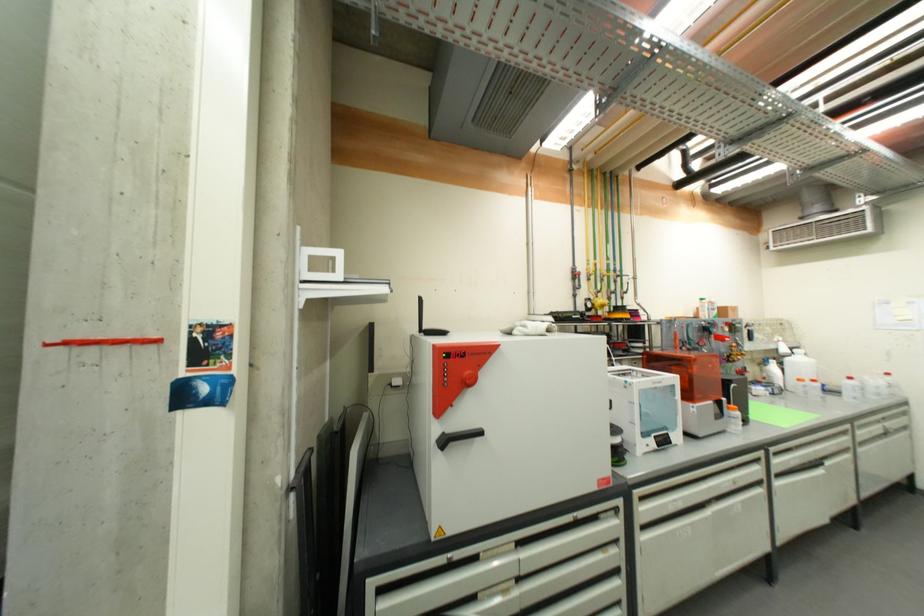
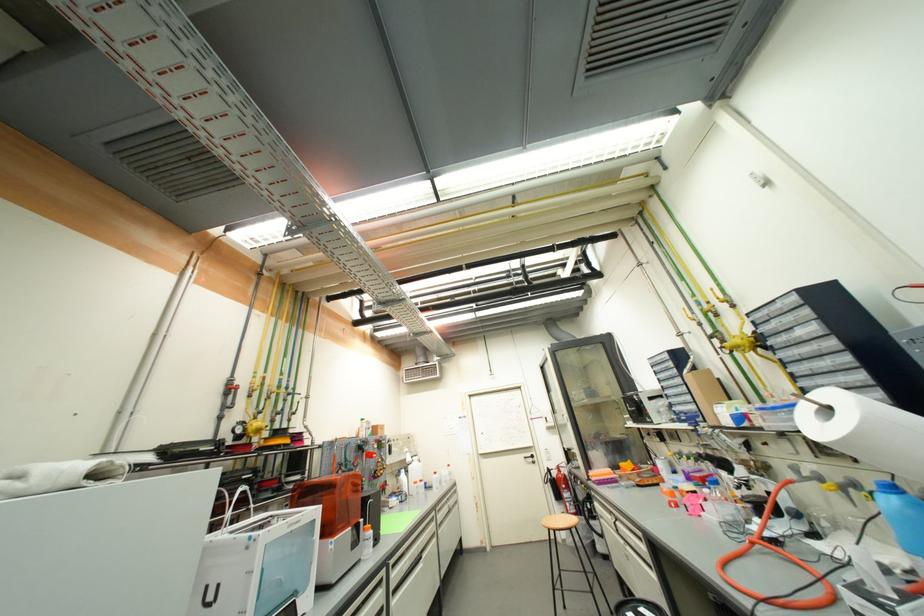
In the second image, find the point that corresponds to point (782, 351) in the first image.

(410, 461)